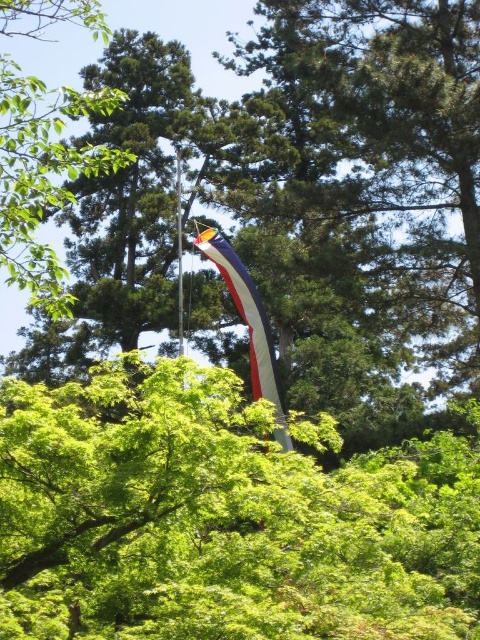
Between green leafy tree at center and white fabric flag at center, which one appears on the left side from the viewer's perspective?

green leafy tree at center

I want to click on green leafy tree at center, so click(219, 518).

Based on the photo, is the position of green leafy tree at upper left more distant than that of white fabric flag at center?

No, green leafy tree at upper left is closer to the viewer.

Which of these two, green leafy tree at upper left or white fabric flag at center, stands taller?

Standing taller between the two is green leafy tree at upper left.

Image resolution: width=480 pixels, height=640 pixels. What do you see at coordinates (44, 176) in the screenshot? I see `green leafy tree at upper left` at bounding box center [44, 176].

The image size is (480, 640). Identify the location of green leafy tree at upper left. (44, 176).

Which is above, green leafy tree at center or green leafy tree at upper left?

Positioned higher is green leafy tree at upper left.

Can you confirm if green leafy tree at center is thinner than green leafy tree at upper left?

Yes, green leafy tree at center is thinner than green leafy tree at upper left.

Where is `green leafy tree at center`? The image size is (480, 640). green leafy tree at center is located at coordinates (219, 518).